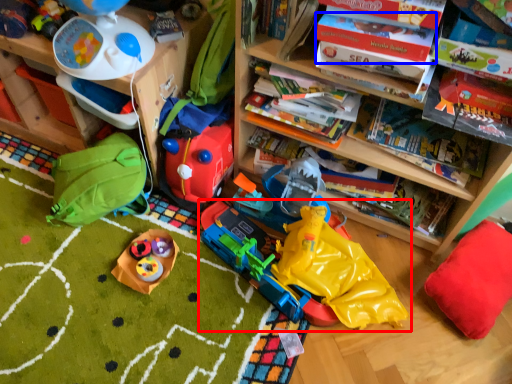
Question: Which object appears farthest to the camera in this image, toy (highlighted by a red box) or book (highlighted by a blue box)?

Choices:
 (A) toy
 (B) book

Answer: (A)